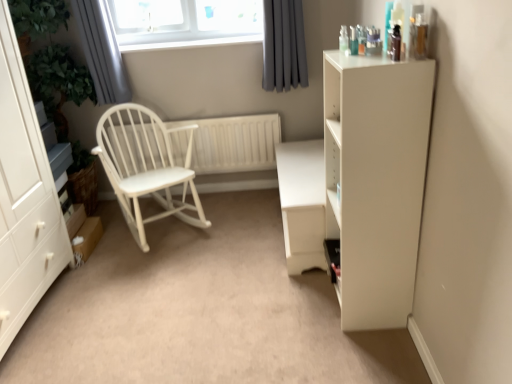
At what (x,y) coordinates should I click in order to perform the action: click on free space in front of white wood rocking chair at left. Please return your answer as a coordinate pair (x, y). This screenshot has height=384, width=512. Looking at the image, I should click on (154, 278).